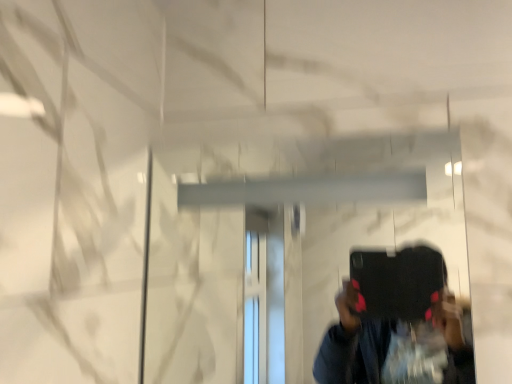
Where is `black matte phone at center`? The height and width of the screenshot is (384, 512). black matte phone at center is located at coordinates (282, 242).

Describe the element at coordinates (282, 242) in the screenshot. The height and width of the screenshot is (384, 512). I see `black matte phone at center` at that location.

Where is `black matte phone at center`? black matte phone at center is located at coordinates (282, 242).